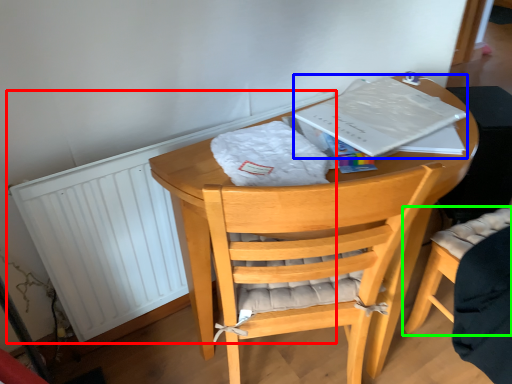
Question: Based on their relative distances, which object is farther from radiator (highlighted by a red box)? Choose from paperback book (highlighted by a blue box) and chair (highlighted by a green box).

Choices:
 (A) paperback book
 (B) chair

Answer: (B)